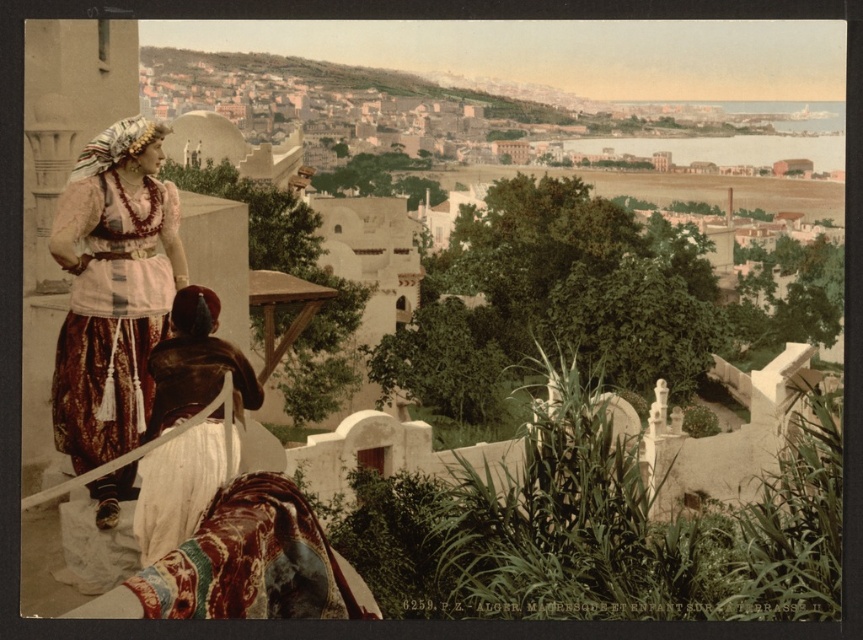
You are standing on the terrace and want to take a photo that includes both the person on the left and the person on the right. Which point, point (83, 458) or point (192, 528), is closer to you and should be prioritized in the frame to ensure both subjects are in focus?

Point (83, 458) is closer to you than point (192, 528), so prioritizing this point in the frame will help ensure both subjects are in focus.

In the scene shown: You are a photographer positioned on the terrace and want to capture both the matte brown dress at left and the brown leather dress at center in a single shot. Based on their positions, which dress will appear closer to the camera in the photo?

The matte brown dress at left will appear closer to the camera because it is located above the brown leather dress at center, meaning it is positioned higher and thus nearer in the frame.

You are a photographer positioned at the center of the terrace. You want to capture a photo that includes both the matte brown dress at left and the seated individual on the right. Based on their positions, which direction should you move to ensure both subjects are in frame?

The matte brown dress at left is positioned at point [112,289]. To include both subjects in the frame, you should move towards the center of the terrace to balance their positions.